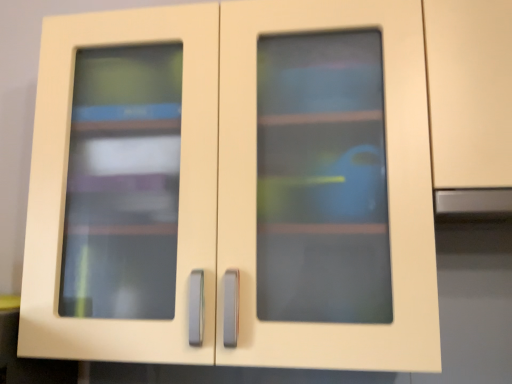
Find the location of a particular element. satin silver exhaust hood at right is located at coordinates (473, 202).

What is the approximate height of satin silver exhaust hood at right?

1.99 inches.

Image resolution: width=512 pixels, height=384 pixels. What do you see at coordinates (473, 202) in the screenshot?
I see `satin silver exhaust hood at right` at bounding box center [473, 202].

Identify the location of satin silver exhaust hood at right. The width and height of the screenshot is (512, 384). (473, 202).